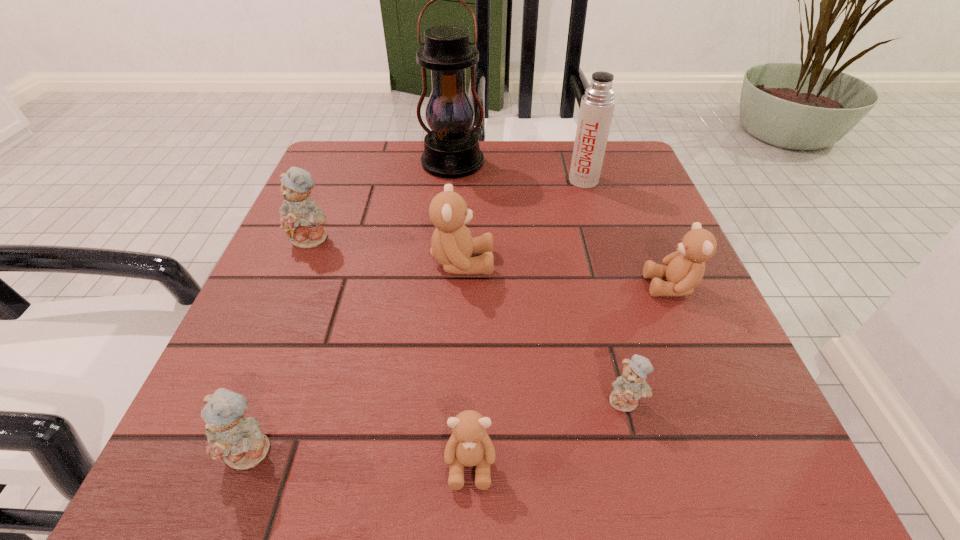
Locate an element on the screen. This screenshot has height=540, width=960. thermos bottle located at the far edge is located at coordinates (597, 106).

This screenshot has height=540, width=960. I want to click on thermos bottle that is at the right edge, so click(x=597, y=106).

Locate an element on the screen. Image resolution: width=960 pixels, height=540 pixels. object that is positioned at the near left corner is located at coordinates (239, 440).

Image resolution: width=960 pixels, height=540 pixels. Identify the location of object that is at the far right corner. (597, 106).

Identify the location of blank space at the far edge. The image size is (960, 540). (483, 150).

The image size is (960, 540). In order to click on blank space at the near edge of the desktop in this screenshot , I will do `click(311, 467)`.

At what (x,y) coordinates should I click in order to perform the action: click on free space at the right edge. Please return your answer as a coordinate pair (x, y). Looking at the image, I should click on (679, 307).

At what (x,y) coordinates should I click in order to perform the action: click on free space at the near left corner of the desktop. Please return your answer as a coordinate pair (x, y). This screenshot has width=960, height=540. Looking at the image, I should click on (283, 488).

At what (x,y) coordinates should I click in order to perform the action: click on vacant space at the far right corner. Please return your answer as a coordinate pair (x, y). Looking at the image, I should click on (619, 178).

Where is `vacant area that lies between the lantern and the nearest brown teddy bear`? Image resolution: width=960 pixels, height=540 pixels. vacant area that lies between the lantern and the nearest brown teddy bear is located at coordinates (462, 314).